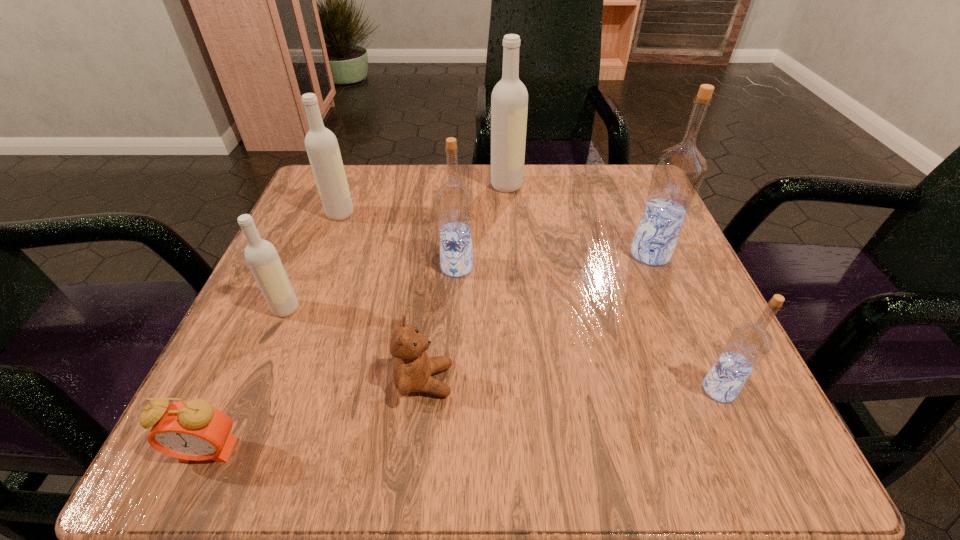
Locate an element on the screen. This screenshot has width=960, height=540. vacant space in between the pink alarm clock and the nearest blue vodka is located at coordinates (464, 420).

At what (x,y) coordinates should I click in order to perform the action: click on vacant point located between the smallest blue vodka and the third object from right to left. Please return your answer as a coordinate pair (x, y). Image resolution: width=960 pixels, height=540 pixels. Looking at the image, I should click on (612, 287).

Find the location of `free space between the leftmost blue vodka and the brown teddy bear`. free space between the leftmost blue vodka and the brown teddy bear is located at coordinates (441, 323).

At what (x,y) coordinates should I click in order to perform the action: click on free area in between the teddy bear and the farthest object. Please return your answer as a coordinate pair (x, y). Looking at the image, I should click on (466, 283).

Where is `object that is the second closest to the rightmost white vodka`? This screenshot has width=960, height=540. object that is the second closest to the rightmost white vodka is located at coordinates (678, 172).

Image resolution: width=960 pixels, height=540 pixels. Identify the location of the closest object relative to the second farthest white vodka. (261, 256).

Image resolution: width=960 pixels, height=540 pixels. In order to click on the fourth closest vodka to the third vodka from left to right in this screenshot , I will do pyautogui.click(x=678, y=172).

Identify which vodka is the third closest to the second smallest white vodka. Please provide its 2D coordinates. Your answer should be formatted as a tuple, i.e. [(x, y)], where the tuple contains the x and y coordinates of a point satisfying the conditions above.

[(509, 101)]

Locate which white vodka ranks second in proximity to the fifth farthest vodka. Please provide its 2D coordinates. Your answer should be formatted as a tuple, i.e. [(x, y)], where the tuple contains the x and y coordinates of a point satisfying the conditions above.

[(509, 101)]

This screenshot has height=540, width=960. Find the location of `white vodka that stands as the closest to the nearest vodka`. white vodka that stands as the closest to the nearest vodka is located at coordinates (509, 101).